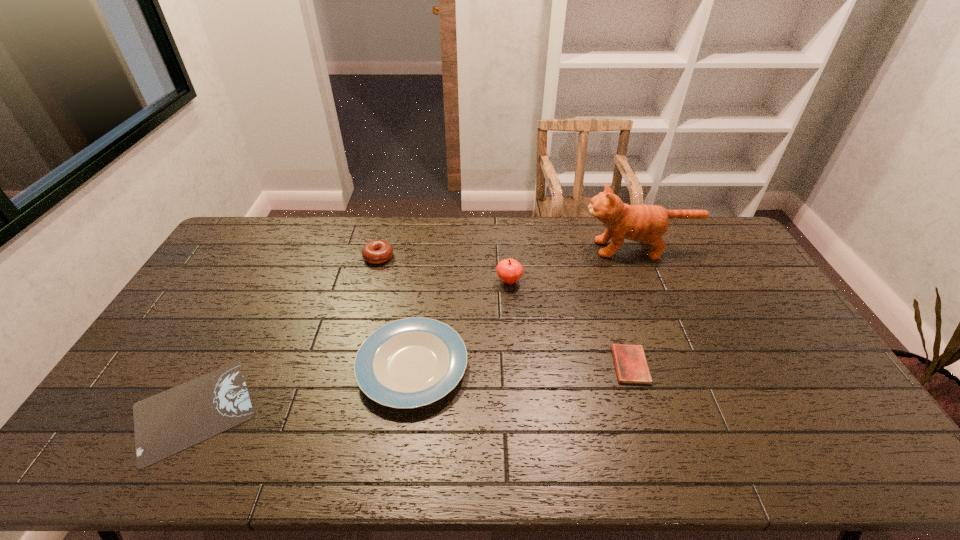
Find the location of `blank space located 0.380m on the face of the cat`. blank space located 0.380m on the face of the cat is located at coordinates (479, 249).

Locate an element on the screen. The width and height of the screenshot is (960, 540). blank space located 0.260m on the right of the fourth nearest object is located at coordinates (599, 281).

This screenshot has width=960, height=540. I want to click on free point located on the back of the fourth shortest object, so click(387, 227).

The image size is (960, 540). I want to click on vacant space positioned 0.360m on the left of the plate, so click(229, 367).

In order to click on vacant space located 0.350m on the left of the second shortest object in this screenshot , I will do `click(490, 365)`.

At what (x,y) coordinates should I click in order to perform the action: click on free region located on the back of the mousepad. Please return your answer as a coordinate pair (x, y). The image size is (960, 540). Looking at the image, I should click on (261, 285).

Identify the location of cat that is positioned at the far edge. (647, 223).

Locate an element on the screen. The image size is (960, 540). doughnut positioned at the far edge is located at coordinates (377, 251).

You are a GUI agent. You are given a task and a screenshot of the screen. Output one action in this format:
    pyautogui.click(x=<x>, y=<y>)
    Task: Click on the object that is positioned at the near edge
    
    Given the screenshot: What is the action you would take?
    pyautogui.click(x=169, y=422)

Find the location of a particular element. This screenshot has height=540, width=960. object that is at the left edge is located at coordinates (169, 422).